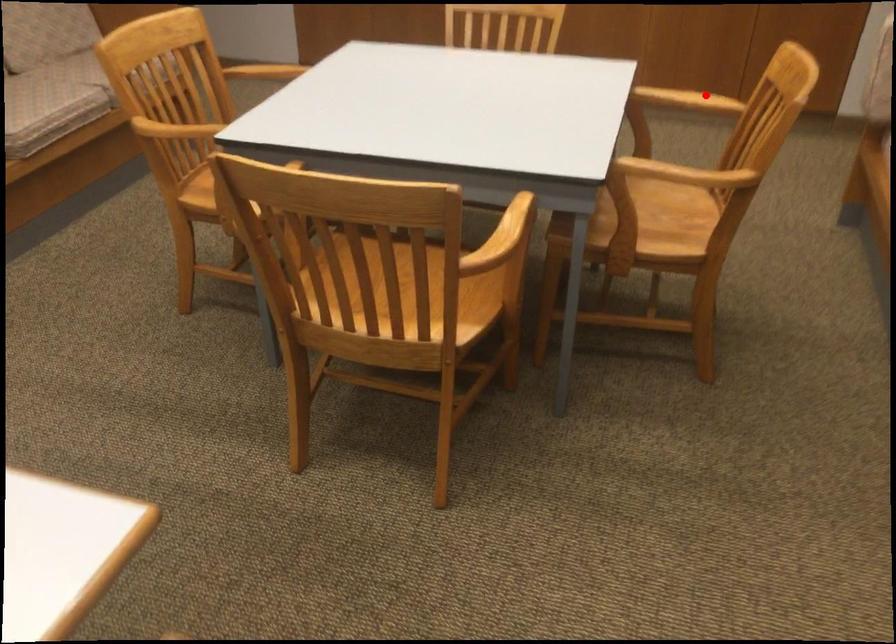
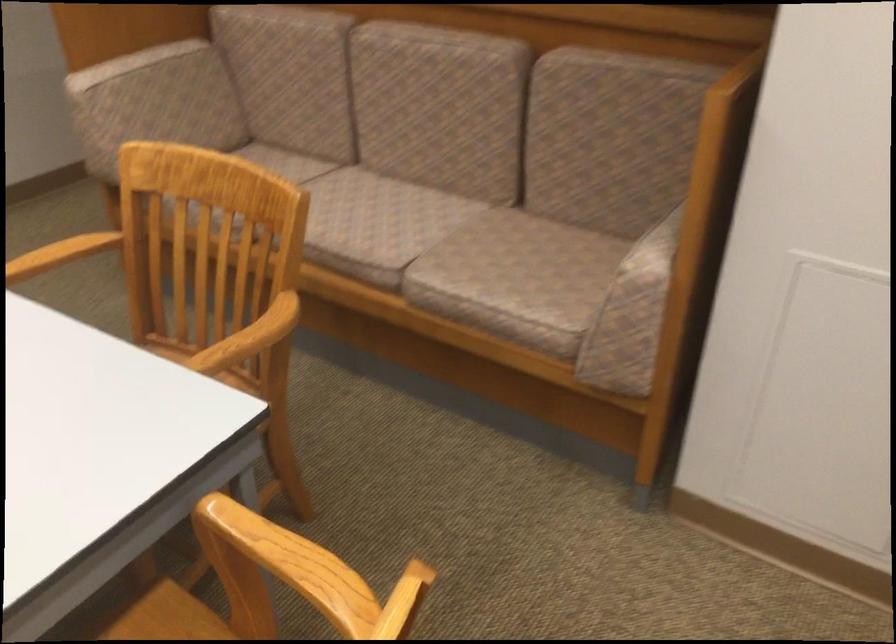
Question: A red point is marked in image1. In image2, is the corresponding 3D point closer to the camera or farther? Reply with the corresponding letter.

Choices:
 (A) The corresponding 3D point is closer.
 (B) The corresponding 3D point is farther.

Answer: (A)